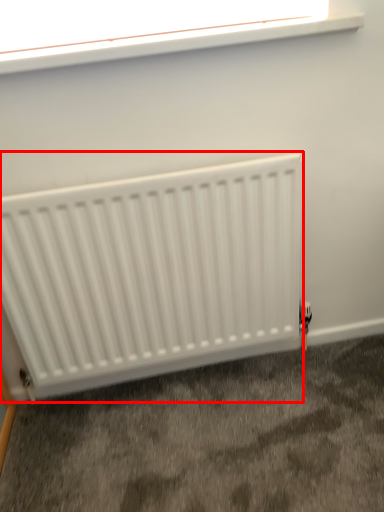
Question: From the image's perspective, what is the correct spatial positioning of radiator (annotated by the red box) in reference to window?

Choices:
 (A) below
 (B) above

Answer: (A)